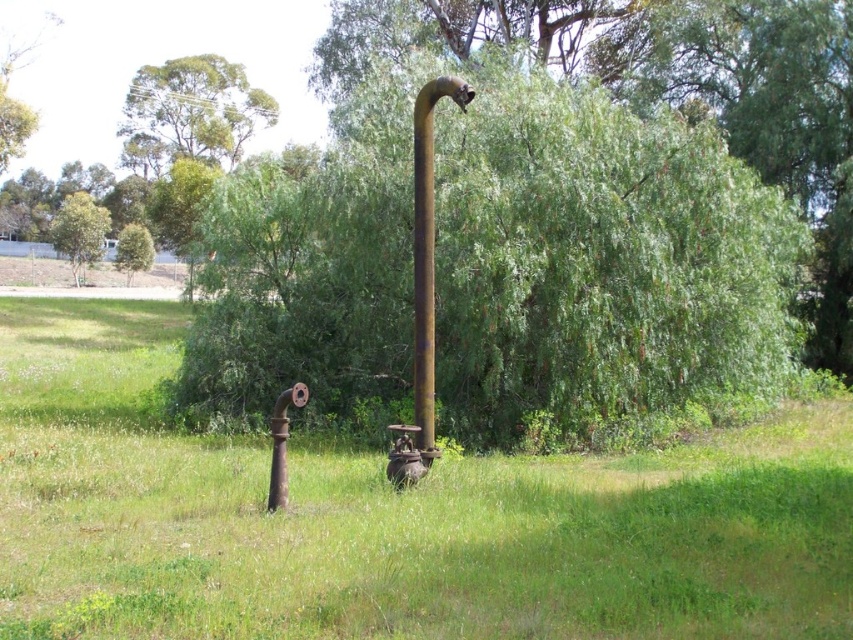
Question: Among these objects, which one is farthest from the camera?

Choices:
 (A) rusty metal pipe at center
 (B) green leafy tree at lower left

Answer: (B)

Question: Based on their relative distances, which object is farther from the green leafy tree at lower left?

Choices:
 (A) green leafy tree at center
 (B) green leafy tree at upper left

Answer: (A)

Question: Is rusty metal pipe at center below green leafy tree at lower left?

Choices:
 (A) yes
 (B) no

Answer: (A)

Question: Is rusty metal pole at center below green leafy tree at upper left?

Choices:
 (A) yes
 (B) no

Answer: (A)

Question: Considering the relative positions of green leafy tree at upper center and green leafy tree at upper left in the image provided, where is green leafy tree at upper center located with respect to green leafy tree at upper left?

Choices:
 (A) left
 (B) right

Answer: (B)

Question: Based on their relative distances, which object is farther from the green leafy tree at upper left?

Choices:
 (A) green leafy tree at center
 (B) green leafy tree at upper center
 (C) green leafy tree at lower left

Answer: (A)